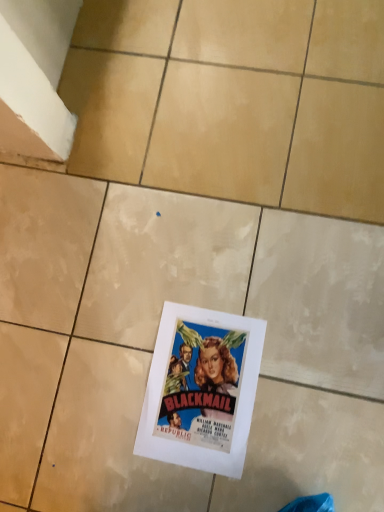
Find the location of a particular element. Image resolution: width=384 pixels, height=512 pixels. unoccupied area in front of matte paper poster at center is located at coordinates (277, 471).